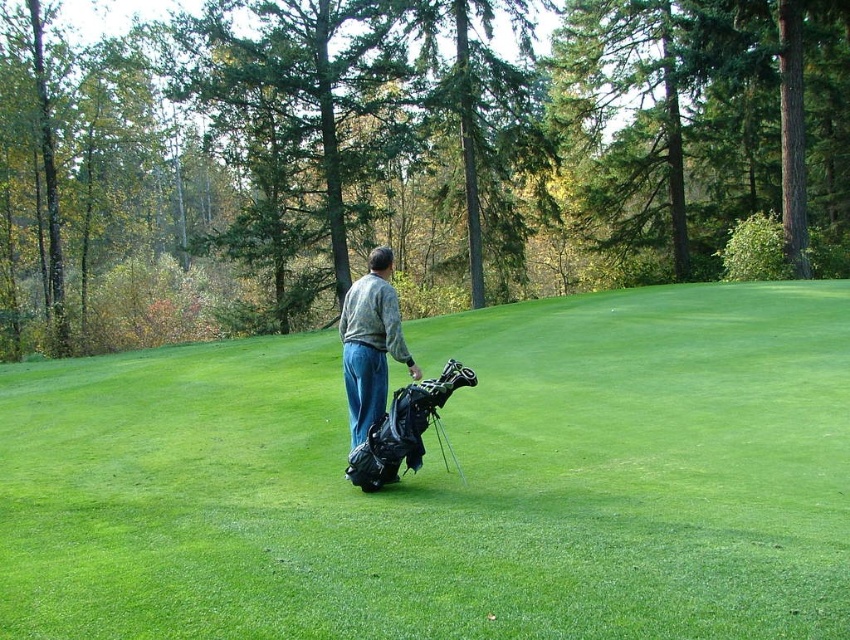
Is green grassy field at center to the left of metallic silver golf club at center from the viewer's perspective?

Yes, green grassy field at center is to the left of metallic silver golf club at center.

This screenshot has height=640, width=850. Describe the element at coordinates (448, 481) in the screenshot. I see `green grassy field at center` at that location.

Image resolution: width=850 pixels, height=640 pixels. Find the location of `green grassy field at center`. green grassy field at center is located at coordinates (448, 481).

Locate an element on the screen. The height and width of the screenshot is (640, 850). green grassy field at center is located at coordinates (448, 481).

Which is behind, point (383, 355) or point (462, 477)?

The point (462, 477) is behind.

Who is more forward, (372, 342) or (451, 456)?

Point (372, 342) is in front.

Find the location of `camouflage jacket at center`. camouflage jacket at center is located at coordinates (370, 342).

Is green grassy field at center positioned at the back of camouflage jacket at center?

No, it is not.

Is green grassy field at center bigger than camouflage jacket at center?

Yes, green grassy field at center is bigger than camouflage jacket at center.

What do you see at coordinates (448, 481) in the screenshot?
I see `green grassy field at center` at bounding box center [448, 481].

Find the location of a particular element. green grassy field at center is located at coordinates (448, 481).